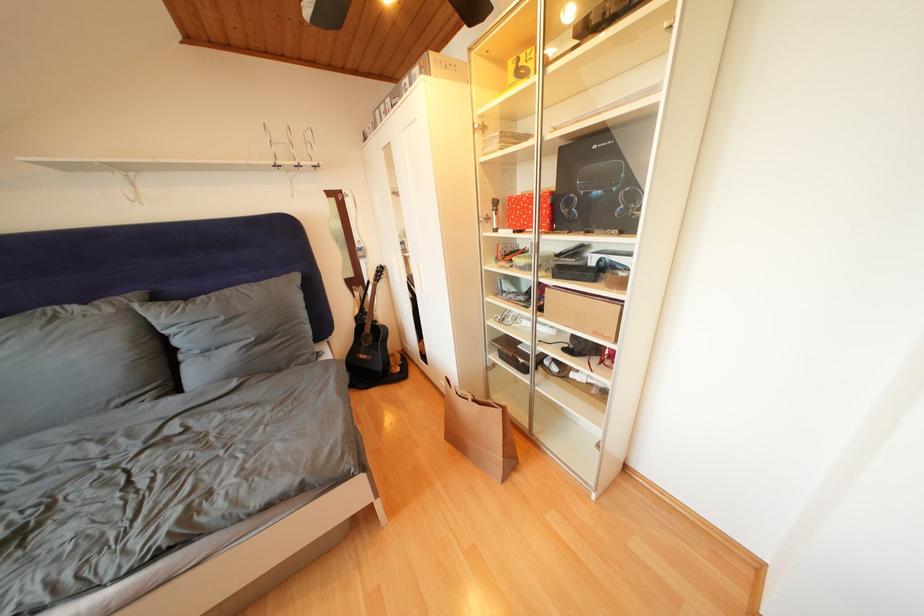
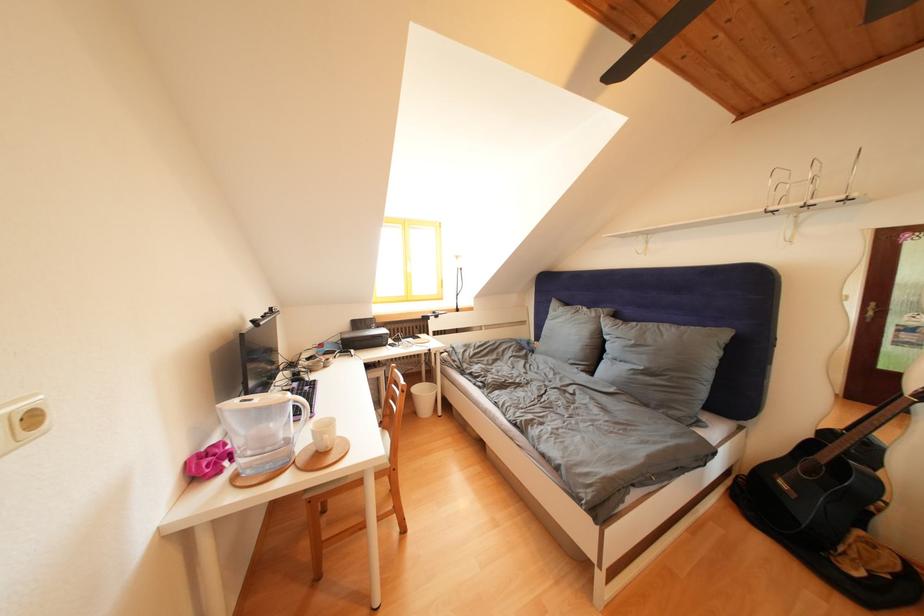
Where in the second image is the point corresponding to [117,315] from the first image?

(602, 320)